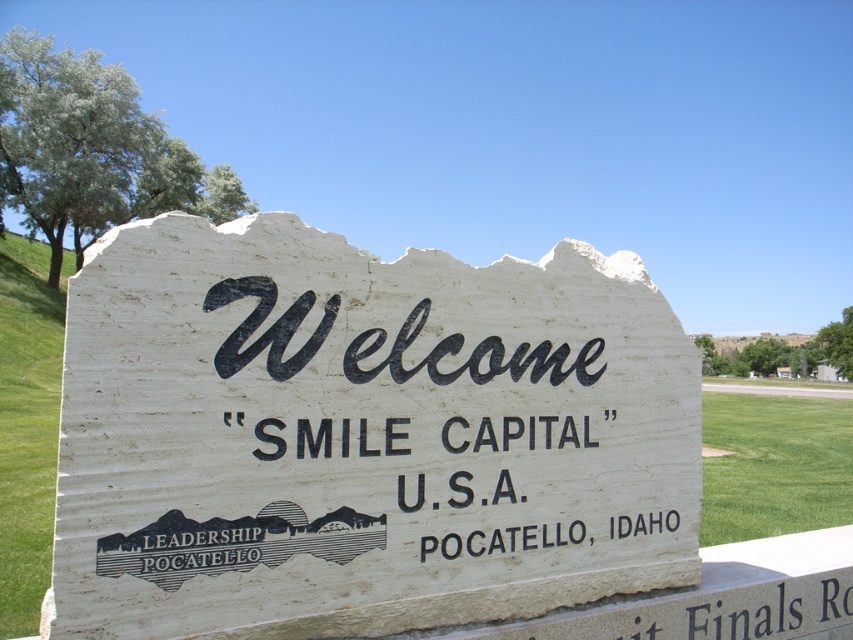
You are standing in a park and see the white stone sign at center and the green grass at lower right. Which object is located below the other?

The white stone sign at center is positioned over the green grass at lower right, meaning the green grass at lower right is below the sign.

You are standing in a park and see the white stone sign at center and the green grass at lower right. Which object is closer to you?

The white stone sign at center is closer to you because it is in front of the green grass at lower right.